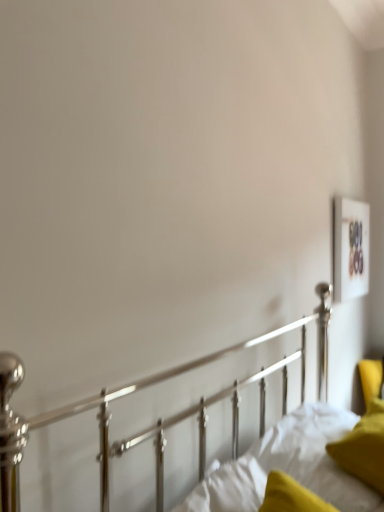
Question: From the image's perspective, is wooden frame at upper right positioned above or below velvet yellow pillow at lower right?

Choices:
 (A) above
 (B) below

Answer: (A)

Question: Based on their sizes in the image, would you say wooden frame at upper right is bigger or smaller than velvet yellow pillow at lower right?

Choices:
 (A) big
 (B) small

Answer: (B)

Question: Estimate the real-world distances between objects in this image. Which object is closer to the wooden frame at upper right?

Choices:
 (A) velvet yellow pillow at lower right
 (B) white soft mattress at lower right

Answer: (A)

Question: Considering the real-world distances, which object is closest to the velvet yellow pillow at lower right?

Choices:
 (A) white soft mattress at lower right
 (B) wooden frame at upper right

Answer: (A)